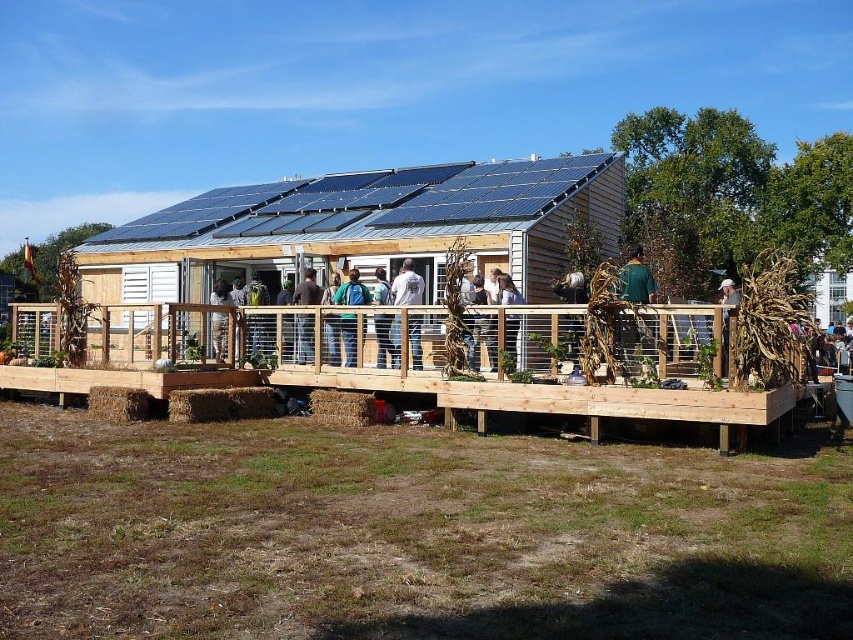
This screenshot has height=640, width=853. I want to click on white fabric shirt at center, so click(x=407, y=285).

This screenshot has height=640, width=853. Identify the location of white fabric shirt at center. (407, 285).

Looking at this image, is green backpack at center positioned before light brown wooden deck at center?

That is True.

Which of these two, green backpack at center or light brown wooden deck at center, stands taller?

light brown wooden deck at center

This screenshot has width=853, height=640. Describe the element at coordinates (352, 291) in the screenshot. I see `green backpack at center` at that location.

Locate an element on the screen. This screenshot has height=640, width=853. green backpack at center is located at coordinates (352, 291).

Between light brown wooden deck at center and light brown wooden fence at center, which one appears on the left side from the viewer's perspective?

Positioned to the left is light brown wooden deck at center.

Who is lower down, light brown wooden deck at center or light brown wooden fence at center?

light brown wooden fence at center is lower down.

Does point (381, 353) come closer to viewer compared to point (509, 317)?

No, (381, 353) is behind (509, 317).

Identify the location of light brown wooden deck at center. The width and height of the screenshot is (853, 640). (383, 339).